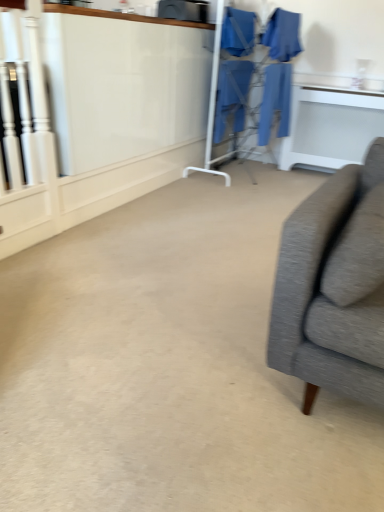
This screenshot has height=512, width=384. I want to click on vacant region in front of blue fabric laundry at center, so click(x=250, y=186).